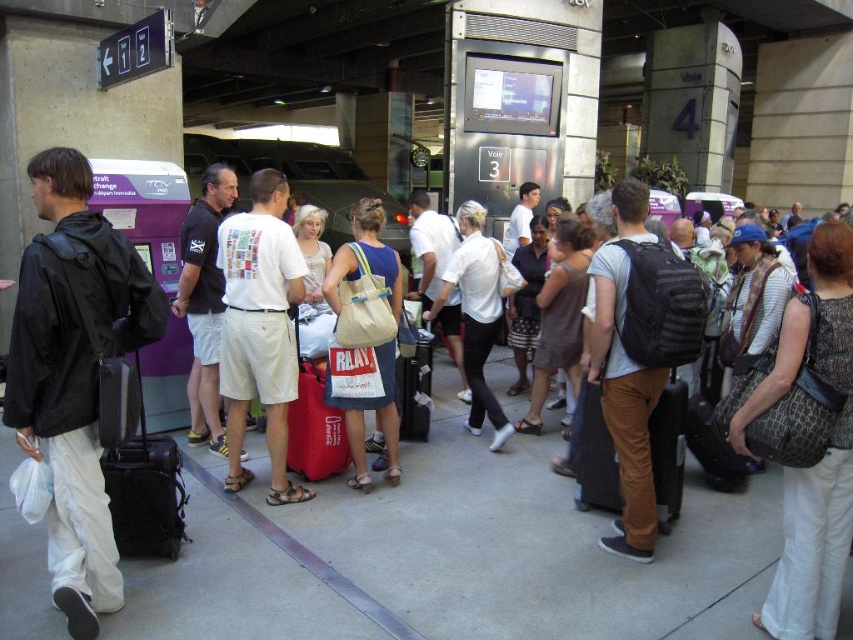
Who is more forward, (x=161, y=540) or (x=306, y=388)?

Point (x=161, y=540) is in front.

Is point (126, 536) in front of point (309, 442)?

That is True.

Measure the distance between black leather suitcase at left and camera.

black leather suitcase at left is 3.00 meters from camera.

Find the location of `black leather suitcase at left`. black leather suitcase at left is located at coordinates (144, 490).

From the picture: How distant is brown fabric dress at center from red fabric suitcase at center?

5.77 feet

What do you see at coordinates (560, 316) in the screenshot?
I see `brown fabric dress at center` at bounding box center [560, 316].

At what (x,y) coordinates should I click in order to perform the action: click on brown fabric dress at center. Please return your answer as a coordinate pair (x, y). This screenshot has width=853, height=640. Looking at the image, I should click on (560, 316).

Who is higher up, patterned fabric purse at center or brown fabric suitcase at center-right?

patterned fabric purse at center is higher up.

Who is taller, patterned fabric purse at center or brown fabric suitcase at center-right?

patterned fabric purse at center is taller.

Is point (796, 540) farther from camera compared to point (590, 412)?

That is False.

The width and height of the screenshot is (853, 640). In order to click on patterned fabric purse at center in this screenshot , I will do click(x=805, y=438).